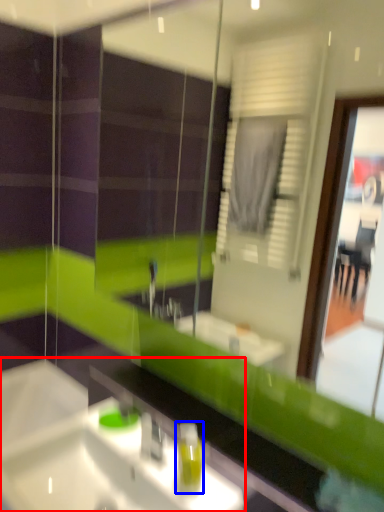
Question: Which of the following is the farthest to the observer, sink (highlighted by a red box) or soap dispenser (highlighted by a blue box)?

Choices:
 (A) sink
 (B) soap dispenser

Answer: (B)